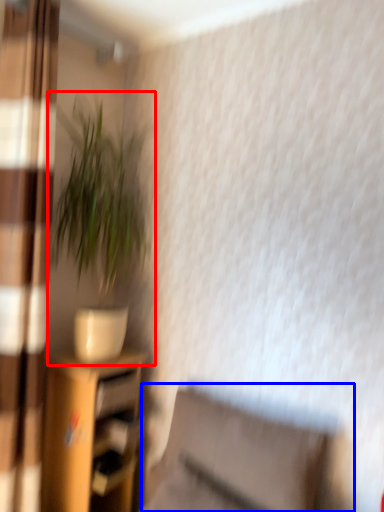
Question: Which object is further to the camera taking this photo, houseplant (highlighted by a red box) or swivel chair (highlighted by a blue box)?

Choices:
 (A) houseplant
 (B) swivel chair

Answer: (A)